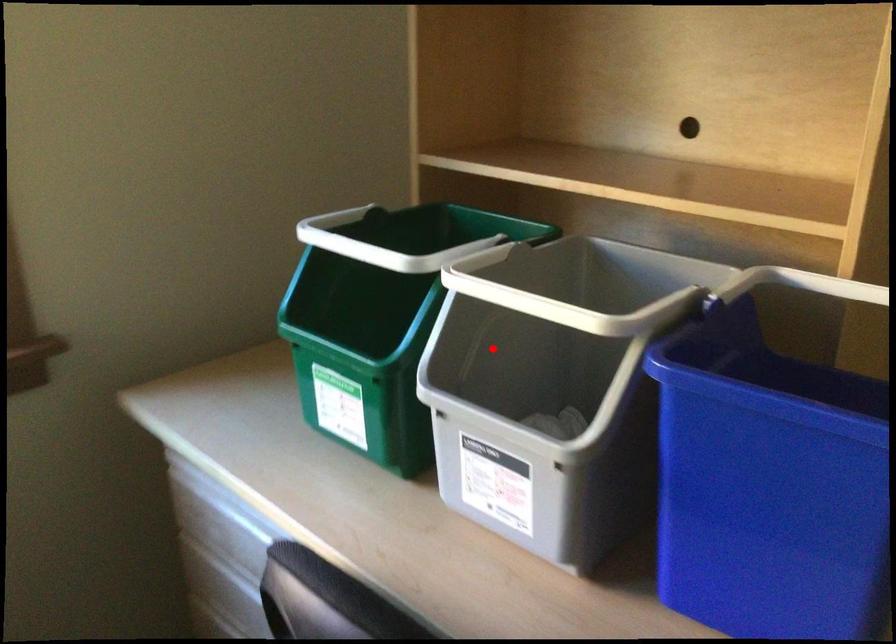
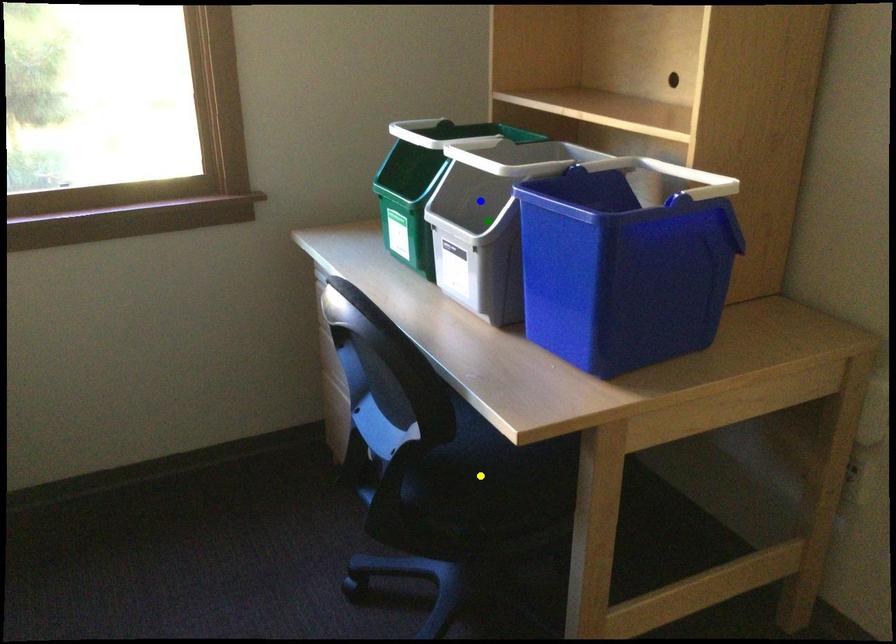
Question: I am providing you with two images of the same scene from different viewpoints. A red point is marked on the first image. You are given multiple points on the second image. Which spot in image 2 lines up with the point in image 1?

Choices:
 (A) blue point
 (B) green point
 (C) yellow point

Answer: (A)